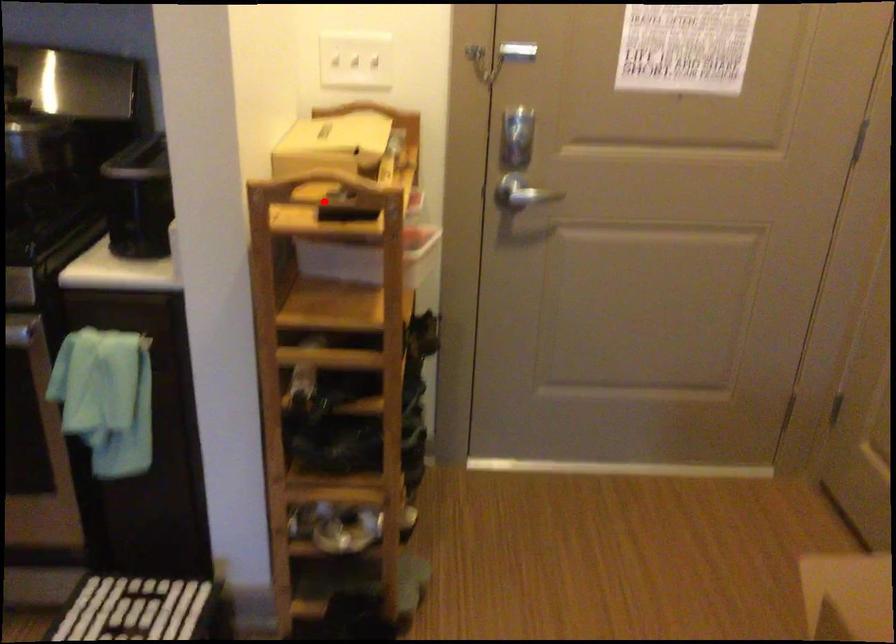
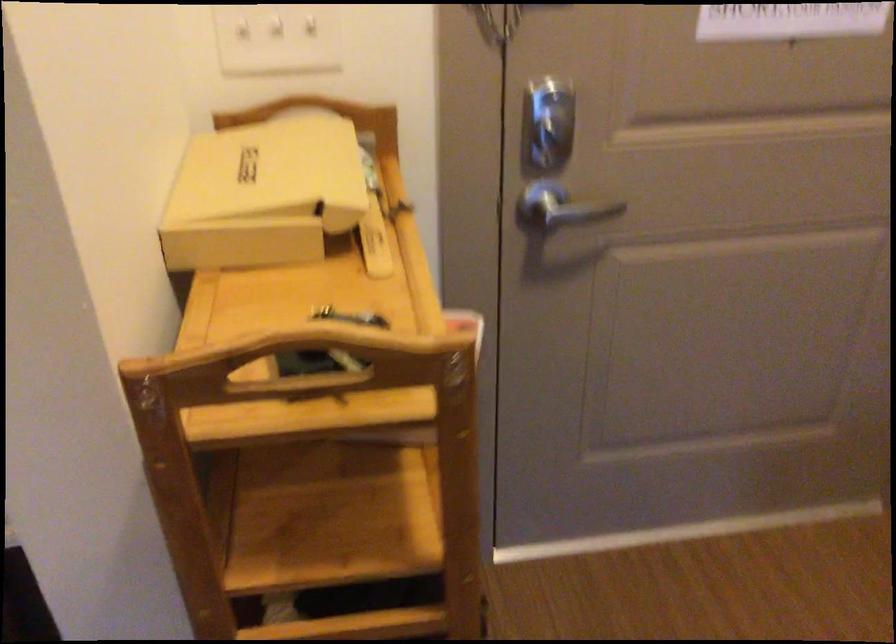
Question: I am providing you with two images of the same scene from different viewpoints. A red point is shown in image1. For the corresponding object point in image2, is it positioned nearer or farther from the camera?

Choices:
 (A) Nearer
 (B) Farther

Answer: (A)